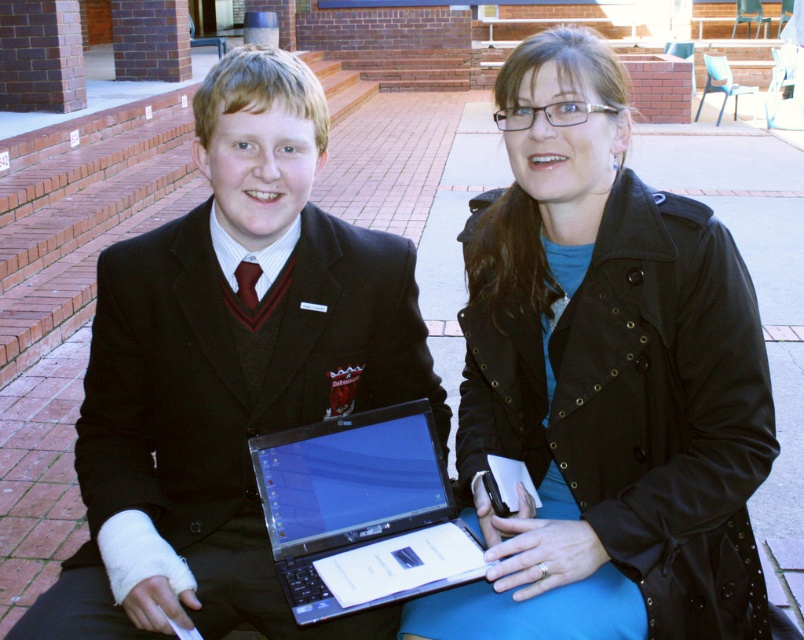
You are a photographer standing in front of the black matte suit at center. You need to take a photo of it using a camera that has a minimum focusing distance of 1.3 meters. Can you take a clear photo without moving closer?

The black matte suit at center and camera are 1.29 meters apart. Since the minimum focusing distance is 1.3 meters, the camera cannot focus clearly at 1.29 meters. You need to move back to ensure the distance is at least 1.3 meters for a clear photo.

From the picture: You are a photographer standing 10 feet away from the two individuals. You want to take a photo of both the matte black jacket at center and the black matte suit at center in the same frame. Given that your camera has a maximum focus range of 12 inches, will you be able to capture both objects clearly in focus?

The matte black jacket at center is 14.12 inches from the black matte suit at center, which exceeds the camera focus range of 12 inches. Therefore, both objects cannot be in focus simultaneously.

You are a photographer trying to capture a clear shot of the silver metallic laptop at center without the matte black jacket at center blocking it. Is the jacket currently covering the laptop?

The matte black jacket at center is positioned over the silver metallic laptop at center, so yes, the jacket is currently covering the laptop and blocking the view.